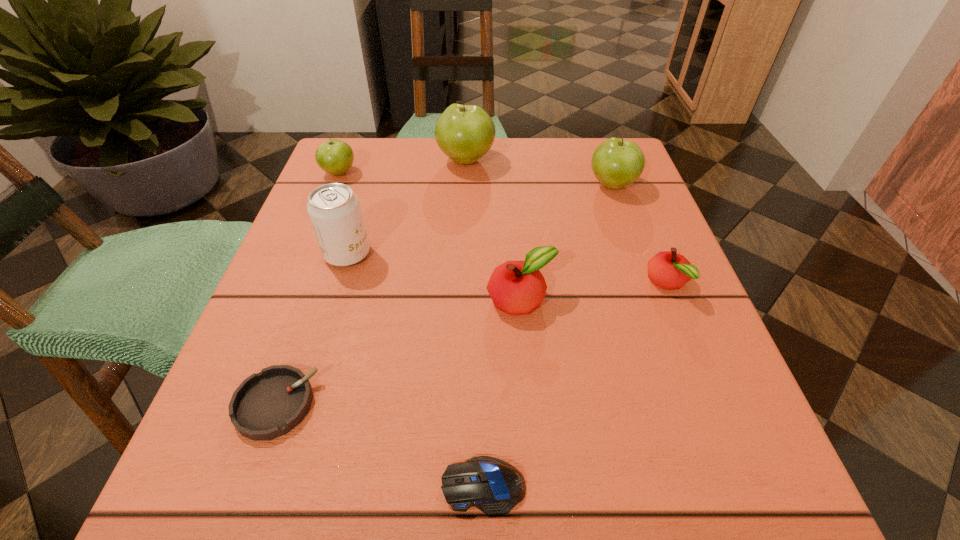
Locate an element on the screen. The width and height of the screenshot is (960, 540). vacant space located on the button side of the nearest object is located at coordinates (290, 485).

Where is `free space located 0.140m on the button side of the nearest object`? free space located 0.140m on the button side of the nearest object is located at coordinates (324, 485).

In order to click on blank area located 0.110m on the button side of the nearest object in this screenshot , I will do `click(348, 485)`.

Where is `object that is at the near edge`? The width and height of the screenshot is (960, 540). object that is at the near edge is located at coordinates (492, 485).

Identify the location of soda can that is at the left edge. (334, 210).

At what (x,y) coordinates should I click in order to perform the action: click on apple present at the left edge. Please return your answer as a coordinate pair (x, y). This screenshot has width=960, height=540. Looking at the image, I should click on (335, 157).

The image size is (960, 540). I want to click on ashtray that is at the left edge, so (x=269, y=404).

This screenshot has width=960, height=540. I want to click on object that is at the far left corner, so click(x=335, y=157).

At what (x,y) coordinates should I click in order to perform the action: click on object at the far right corner. Please return your answer as a coordinate pair (x, y). The height and width of the screenshot is (540, 960). Looking at the image, I should click on (616, 163).

I want to click on vacant space at the far edge of the desktop, so click(x=402, y=160).